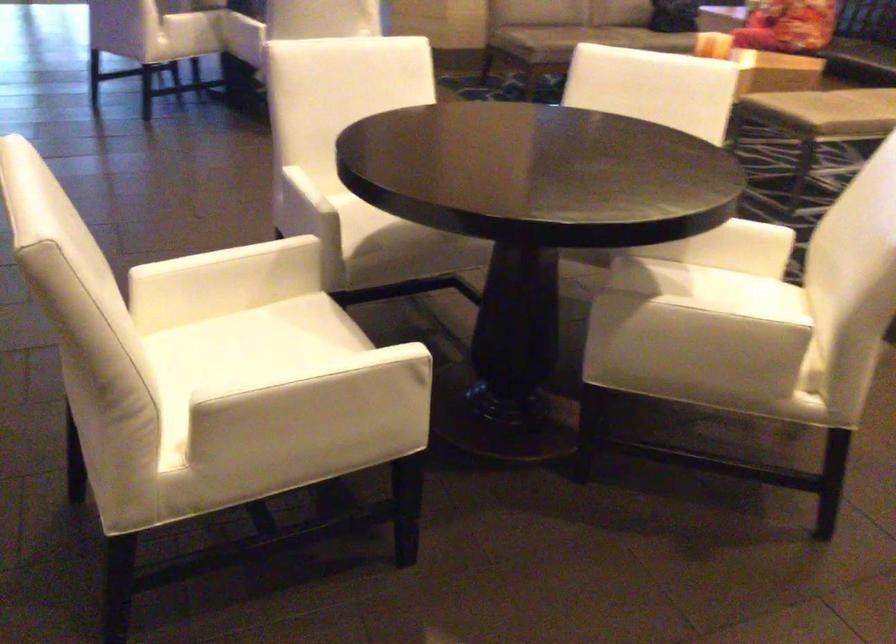
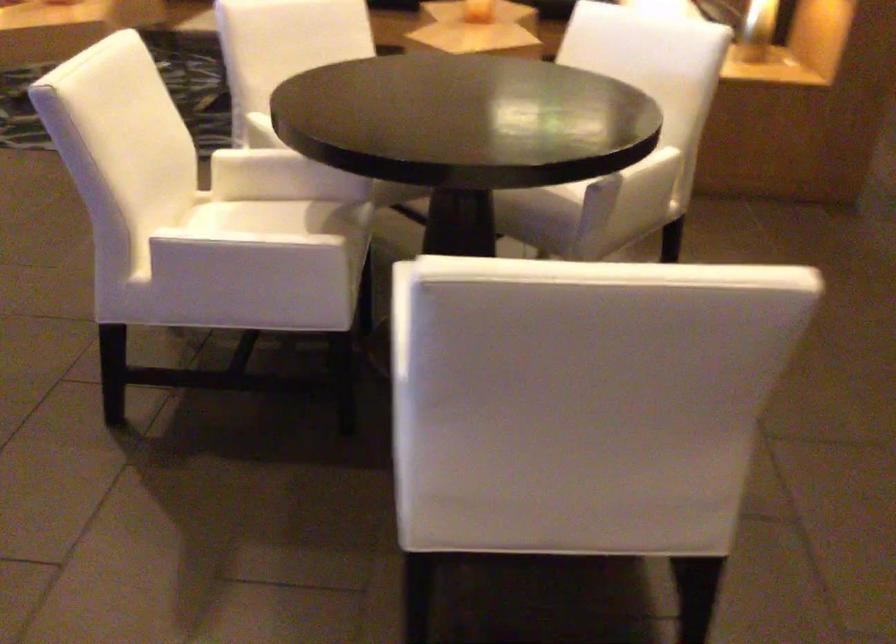
The point at (412, 240) is marked in the first image. Where is the corresponding point in the second image?

(347, 240)